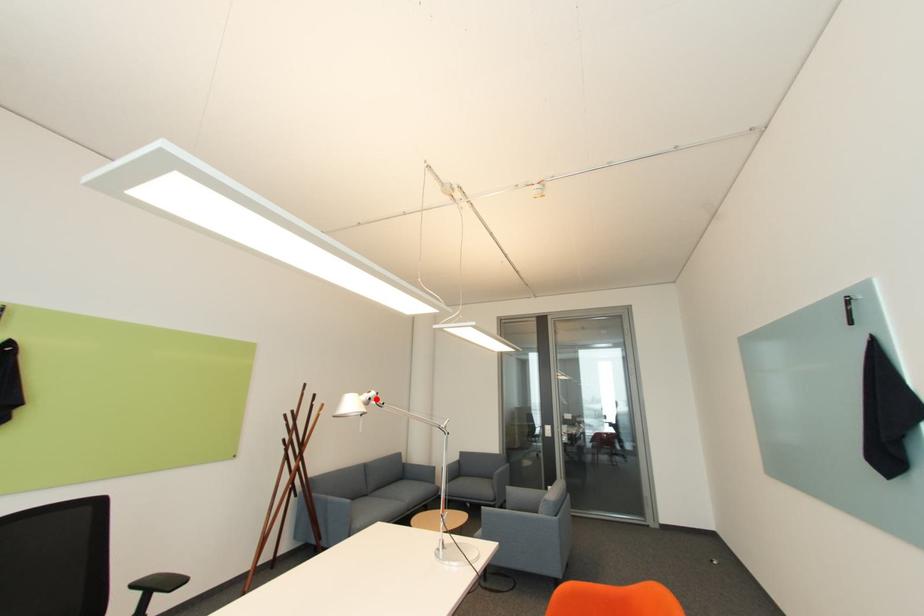
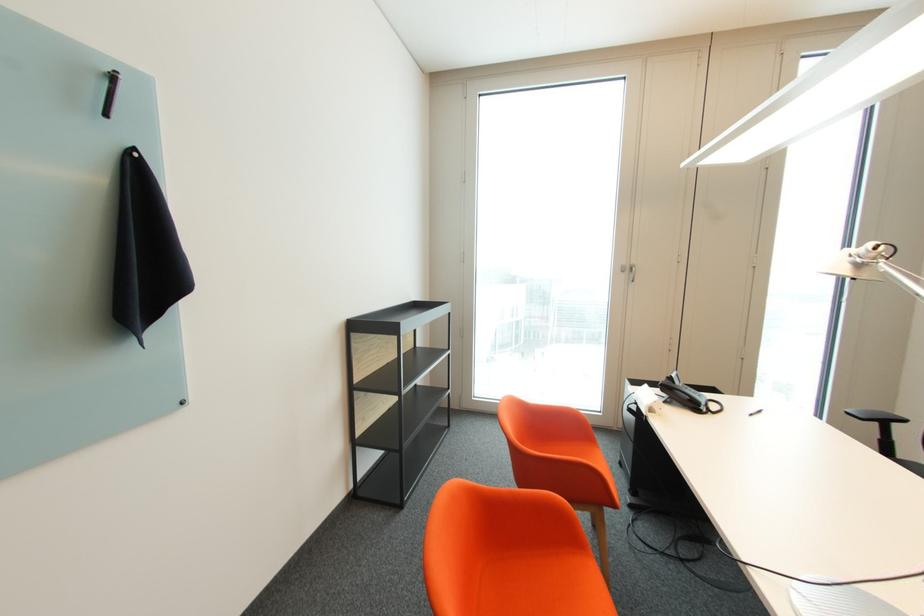
Where in the second image is the point corresponding to the highlighted location from the first image?

(860, 256)